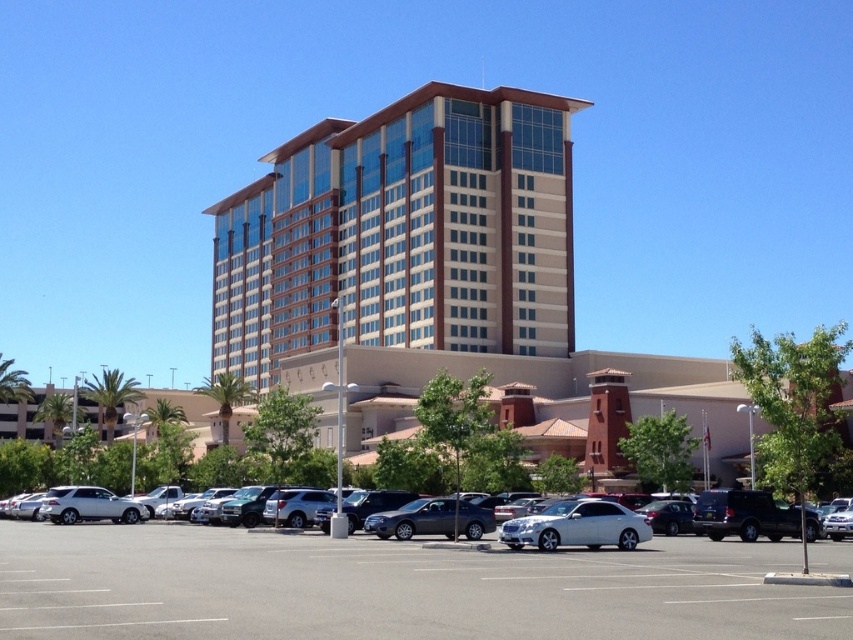
Which is above, beige glass building at center or white glossy sedan at center?

beige glass building at center

Where is `beige glass building at center`? The width and height of the screenshot is (853, 640). beige glass building at center is located at coordinates (403, 234).

Is the position of gray asphalt parking lot at lower center more distant than that of white glossy sedan at center?

That is False.

Based on the photo, who is shorter, gray asphalt parking lot at lower center or white glossy sedan at center?

With less height is white glossy sedan at center.

Is point (265, 604) in front of point (544, 534)?

Yes, point (265, 604) is closer to viewer.

Where is `gray asphalt parking lot at lower center`? The width and height of the screenshot is (853, 640). gray asphalt parking lot at lower center is located at coordinates (393, 588).

Is white glossy sedan at center below silver metallic sedan at center?

No.

Does white glossy sedan at center appear on the left side of silver metallic sedan at center?

No, white glossy sedan at center is not to the left of silver metallic sedan at center.

Does point (548, 525) lie in front of point (703, 493)?

Yes, point (548, 525) is closer to viewer.

Locate an element on the screen. This screenshot has height=640, width=853. white glossy sedan at center is located at coordinates (577, 525).